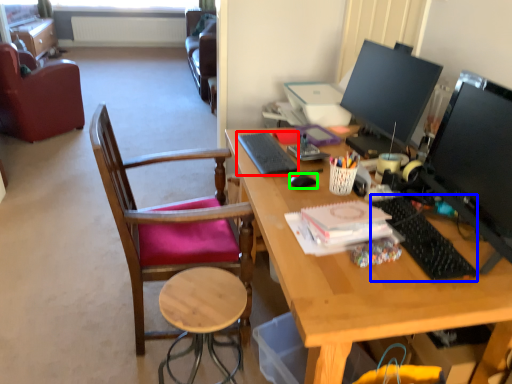
Question: Considering the real-world distances, which object is closest to notepad (highlighted by a red box)? keyboard (highlighted by a blue box) or mouse (highlighted by a green box).

Choices:
 (A) keyboard
 (B) mouse

Answer: (B)